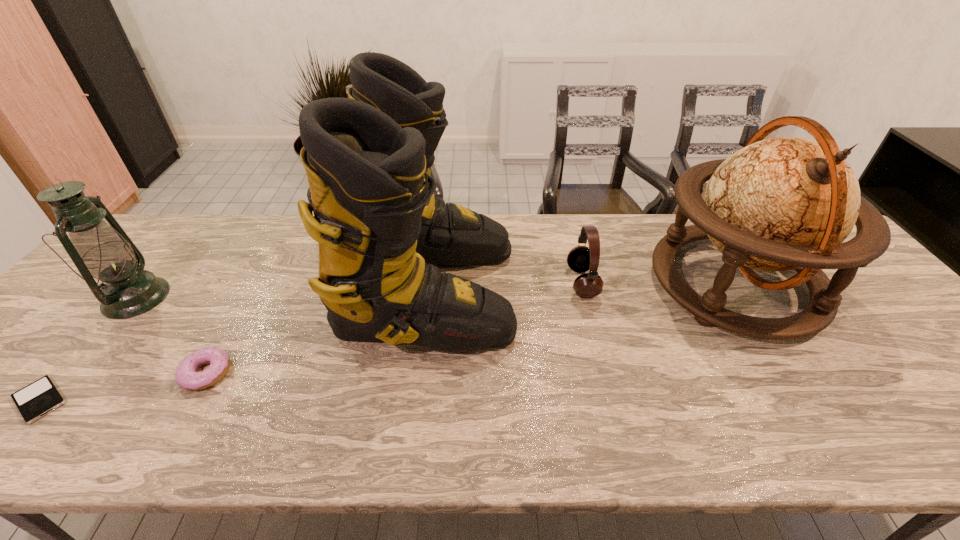
In the image, there is a desktop. Where is `vacant space at the far edge`? vacant space at the far edge is located at coordinates (245, 253).

Image resolution: width=960 pixels, height=540 pixels. In the image, there is a desktop. In order to click on free space at the near edge in this screenshot , I will do `click(270, 437)`.

Identify the location of vacant space at the right edge. (945, 376).

The width and height of the screenshot is (960, 540). I want to click on vacant area between the fourth object from left to right and the doughnut, so click(318, 332).

The image size is (960, 540). In order to click on vacant point located between the fifth object from left to right and the third object from right to left in this screenshot , I will do `click(505, 286)`.

Image resolution: width=960 pixels, height=540 pixels. I want to click on vacant area that lies between the oil lamp and the second shortest object, so click(x=171, y=335).

This screenshot has width=960, height=540. In order to click on blank region between the fourth object from left to right and the third object from left to right in this screenshot , I will do [318, 332].

Where is `unoccupied position between the ski boots and the doughnut`? The height and width of the screenshot is (540, 960). unoccupied position between the ski boots and the doughnut is located at coordinates (318, 332).

The image size is (960, 540). What are the coordinates of `empty space that is in between the third object from right to left and the third tallest object` in the screenshot? It's located at (282, 294).

Locate an element on the screen. object that is the closest to the ski boots is located at coordinates (580, 259).